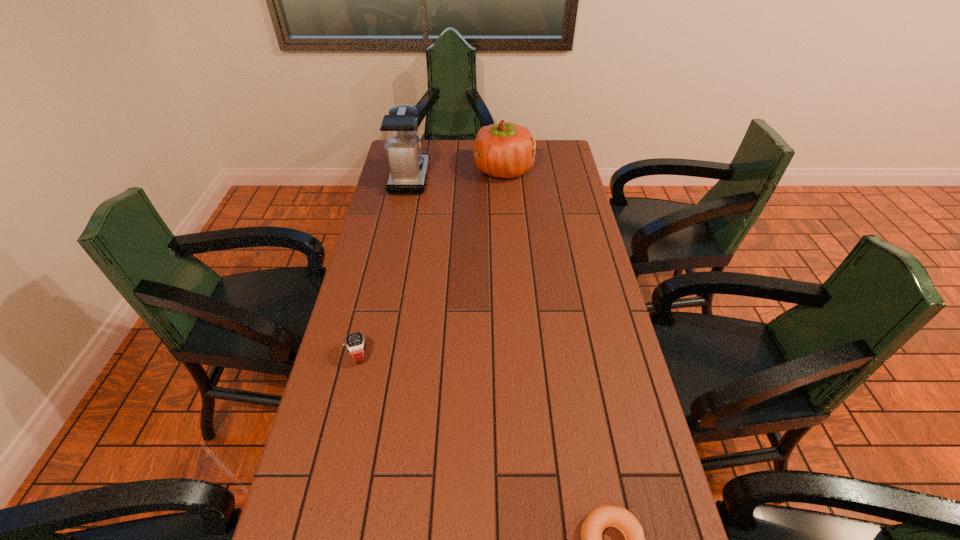
I want to click on free point between the watch and the tallest object, so click(x=384, y=266).

At what (x,y) coordinates should I click in order to perform the action: click on free space between the pumpkin and the coffee maker. Please return your answer as a coordinate pair (x, y). The image size is (960, 540). Looking at the image, I should click on (457, 174).

You are a GUI agent. You are given a task and a screenshot of the screen. Output one action in this format:
    pyautogui.click(x=<x>, y=<y>)
    Task: Click on the free space between the third tallest object and the coffee maker
    The width and height of the screenshot is (960, 540).
    Given the screenshot: What is the action you would take?
    pyautogui.click(x=384, y=266)

Image resolution: width=960 pixels, height=540 pixels. I want to click on blank region between the second nearest object and the pumpkin, so click(431, 262).

Identify the location of object that is the third closest to the coffee maker. (604, 516).

Select which object appears as the second closest to the bagel. Please provide its 2D coordinates. Your answer should be formatted as a tuple, i.e. [(x, y)], where the tuple contains the x and y coordinates of a point satisfying the conditions above.

[(506, 150)]

The width and height of the screenshot is (960, 540). Find the location of `free spot that satisfies the following two spatial constraints: 1. at the front of the coffee maker where the controls are located; 2. on the front side of the third tallest object`. free spot that satisfies the following two spatial constraints: 1. at the front of the coffee maker where the controls are located; 2. on the front side of the third tallest object is located at coordinates (374, 354).